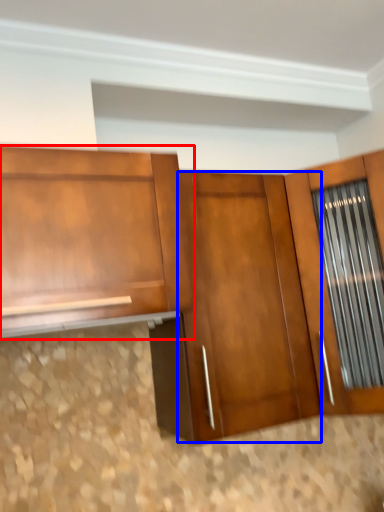
Question: Which object is closer to the camera taking this photo, cabinetry (highlighted by a red box) or door (highlighted by a blue box)?

Choices:
 (A) cabinetry
 (B) door

Answer: (A)